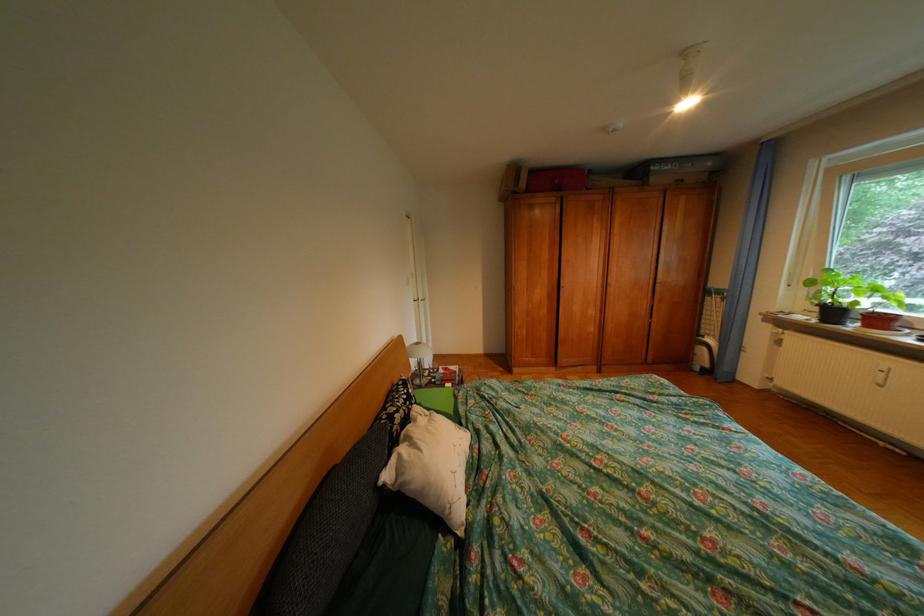
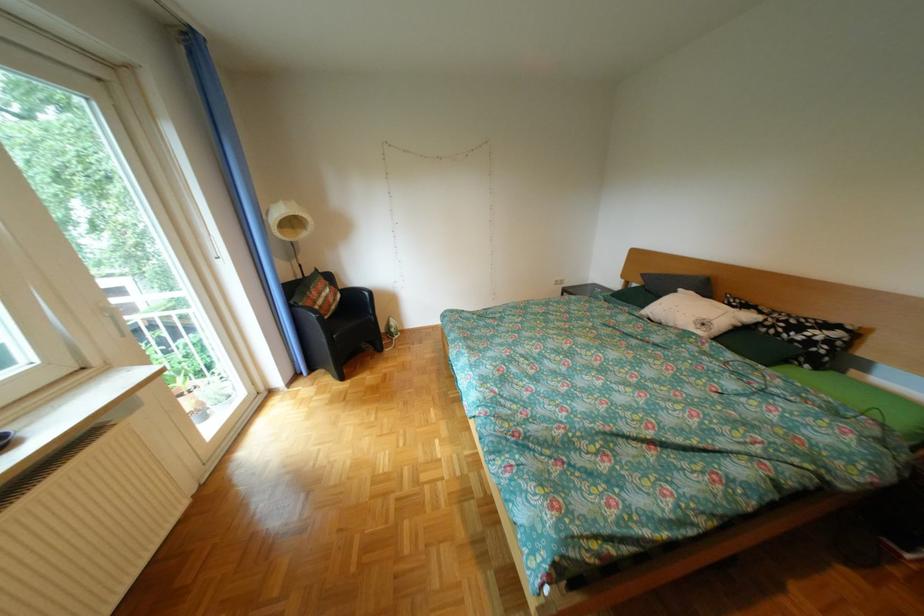
In the second image, find the point that corresponds to the point at 411,411 in the first image.

(775, 313)